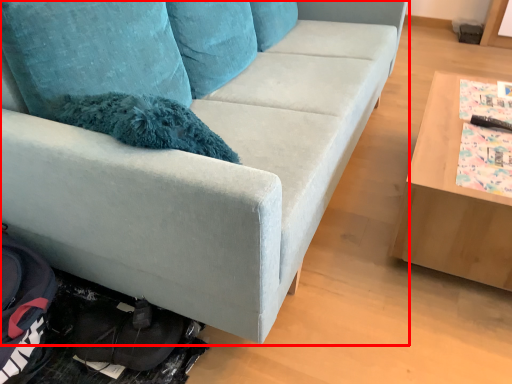
Question: From the image's perspective, considering the relative positions of studio couch (annotated by the red box) and table in the image provided, where is studio couch (annotated by the red box) located with respect to the staircase?

Choices:
 (A) above
 (B) below

Answer: (A)